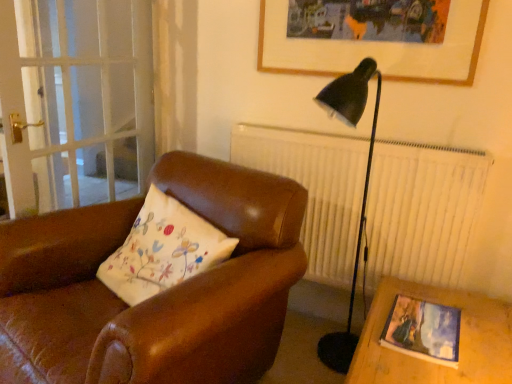
The image size is (512, 384). What are the coordinates of `vacant region above matte wooden picture frame at lower right, which ranks as the 2th picture frame in top-to-bottom order (from a real-world perspective)` in the screenshot? It's located at (428, 331).